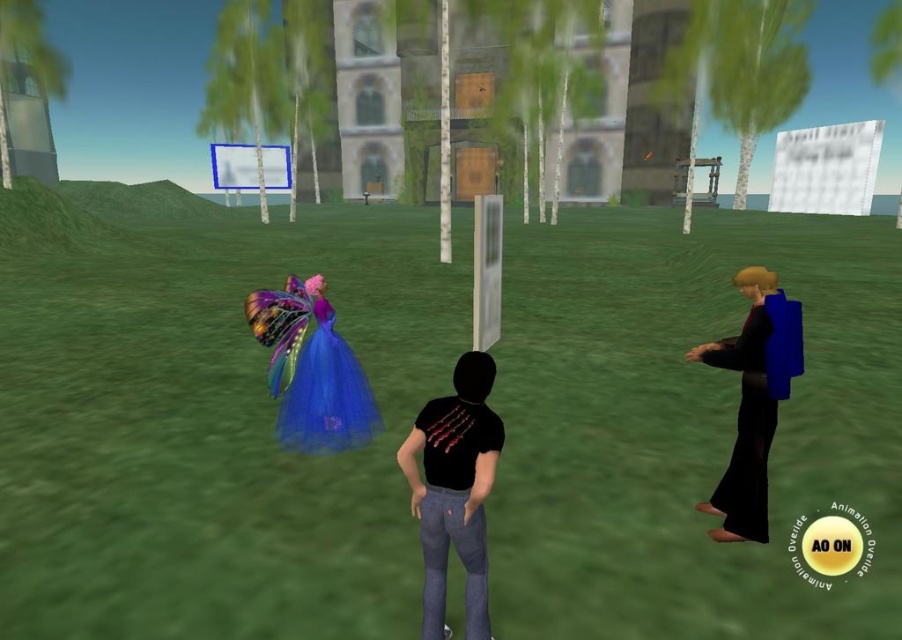
You are navigating through a virtual park and need to determine the order of two points in your path. Which point is closer to you, point (298, 358) or point (716, 532)?

Point (298, 358) is closer to you because it is further to the viewer than point (716, 532).

You are a character in the virtual environment and need to reach the metallic blue sign at upper center. However, there is a black matte dress at right in your path. Can you walk directly to the sign without moving around the dress?

The black matte dress at right is in front of the metallic blue sign at upper center, so you cannot walk directly to the sign without moving around the dress.

You are a character in this virtual environment and need to decide whether to approach the black matte dress at right or the metallic blue sign at upper center first. Based on their sizes, which object should you prioritize approaching if you want to interact with the larger one first?

The metallic blue sign at upper center is larger than the black matte dress at right, so you should prioritize approaching the metallic blue sign at upper center first.